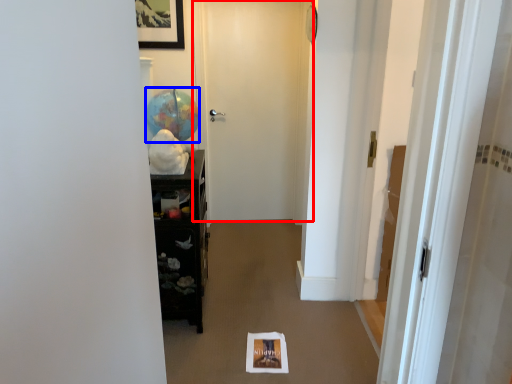
Question: Which object is closer to the camera taking this photo, door (highlighted by a red box) or balloon (highlighted by a blue box)?

Choices:
 (A) door
 (B) balloon

Answer: (B)